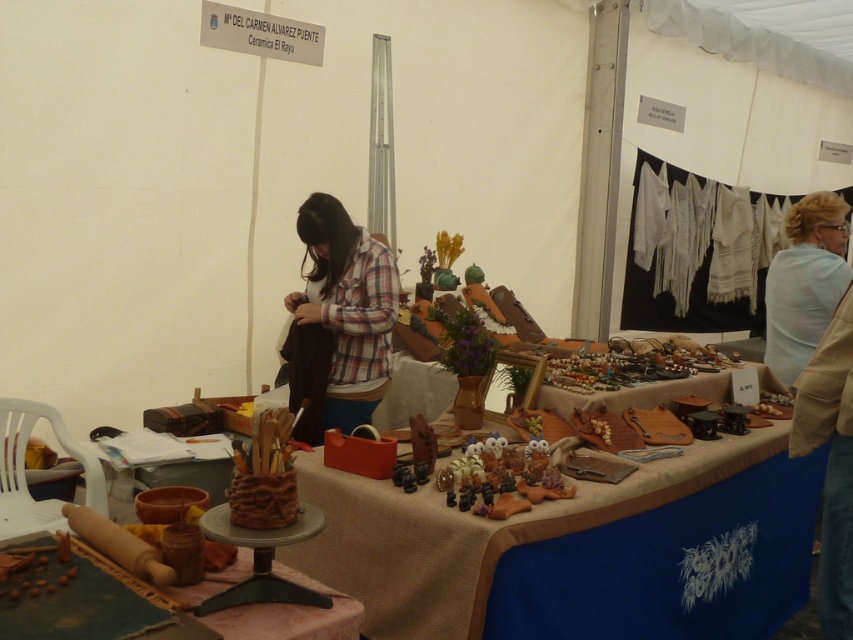
Based on the photo, who is positioned more to the left, plaid fabric shirt at center or light blue fabric at upper right?

From the viewer's perspective, plaid fabric shirt at center appears more on the left side.

Does point (299, 404) lie in front of point (793, 256)?

Yes, it is.

Identify the location of plaid fabric shirt at center. Image resolution: width=853 pixels, height=640 pixels. (339, 321).

Is burlap tablecloth at center wider than light blue fabric at upper right?

Indeed, burlap tablecloth at center has a greater width compared to light blue fabric at upper right.

Is point (332, 545) positioned behind point (801, 284)?

No, it is not.

Identify the location of burlap tablecloth at center. (572, 548).

Who is more distant from viewer, (x=316, y=259) or (x=320, y=620)?

Positioned behind is point (x=316, y=259).

Between point (386, 332) and point (312, 608), which one is positioned in front?

Point (312, 608) is more forward.

Who is more distant from viewer, (x=332, y=314) or (x=190, y=596)?

Point (x=332, y=314)

At what (x,y) coordinates should I click in order to perform the action: click on plaid fabric shirt at center. Please return your answer as a coordinate pair (x, y). Looking at the image, I should click on (339, 321).